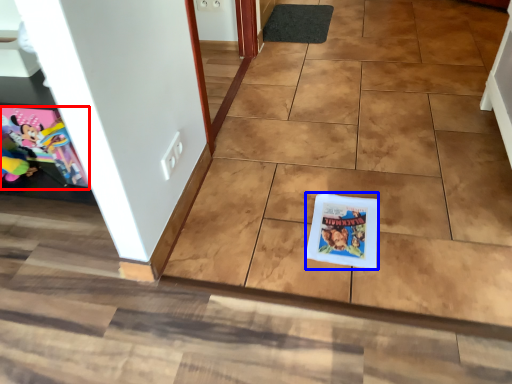
Question: Among these objects, which one is farthest to the camera, comic book (highlighted by a red box) or comic book (highlighted by a blue box)?

Choices:
 (A) comic book
 (B) comic book

Answer: (A)